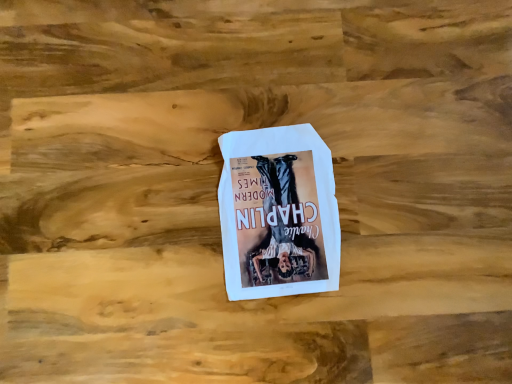
The image size is (512, 384). Describe the element at coordinates (278, 213) in the screenshot. I see `white paper at center` at that location.

You are a GUI agent. You are given a task and a screenshot of the screen. Output one action in this format:
    pyautogui.click(x=<x>, y=<y>)
    Task: Click on the white paper at center
    This screenshot has width=512, height=384.
    Given the screenshot: What is the action you would take?
    pyautogui.click(x=278, y=213)

Identify the location of white paper at center. (278, 213).